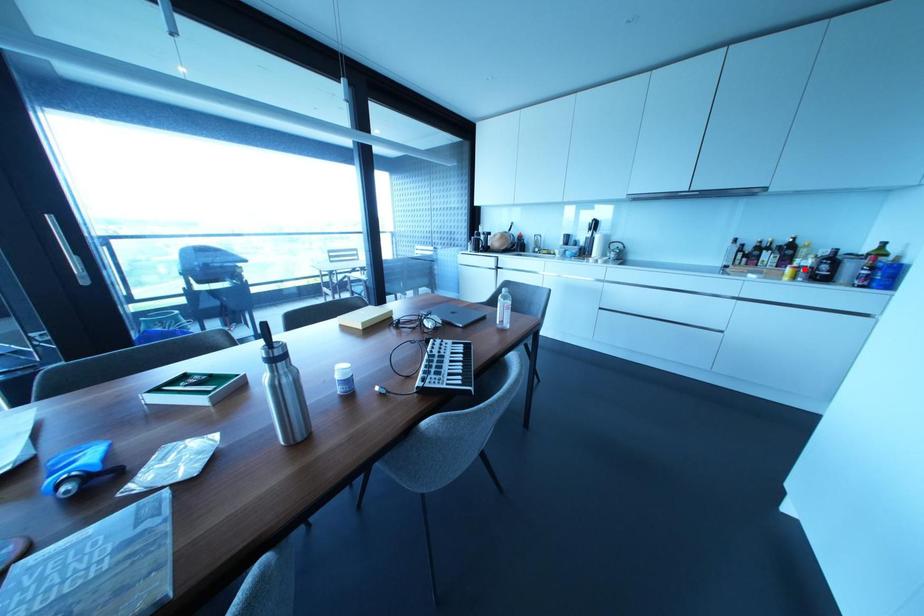
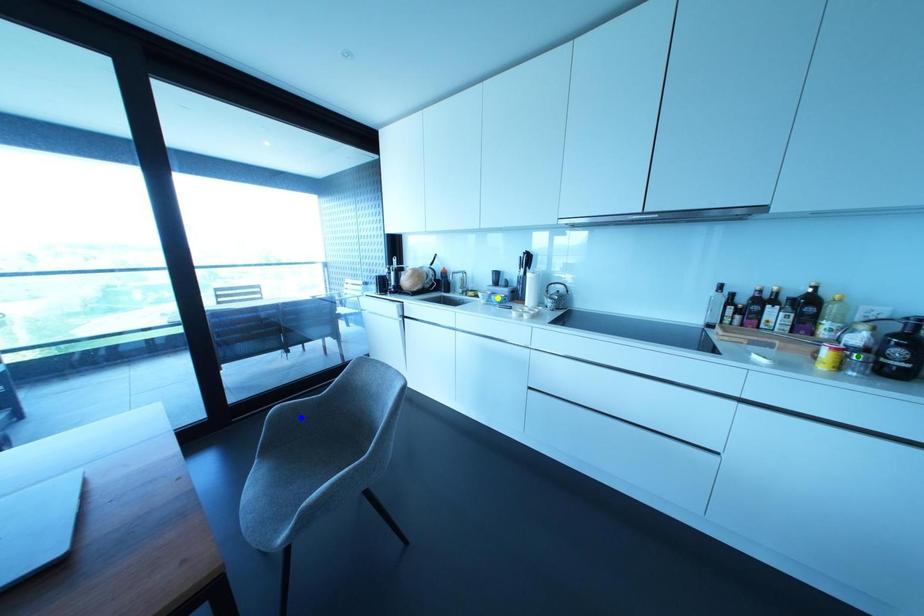
Question: I am providing you with two images of the same scene from different viewpoints. A red point is marked on the first image. You are given multiple points on the second image. In image 2, which mark is for the same physical point as the one in image 1?

Choices:
 (A) blue point
 (B) yellow point
 (C) green point

Answer: (C)